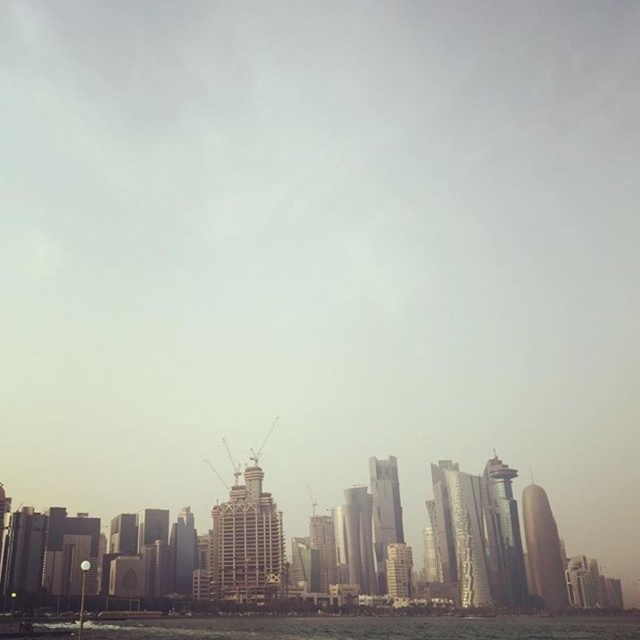
You are an architect evaluating the cityscape. Based on the scene, which object is taller between the glassy skyscraper at center and the gold metallic tower at right?

The glassy skyscraper at center is taller than the gold metallic tower at right.

You are an architect evaluating the cityscape. You notice the metallic glass skyscraper at center and the glassy skyscraper at center. Which one is shorter?

The metallic glass skyscraper at center is shorter than the glassy skyscraper at center.